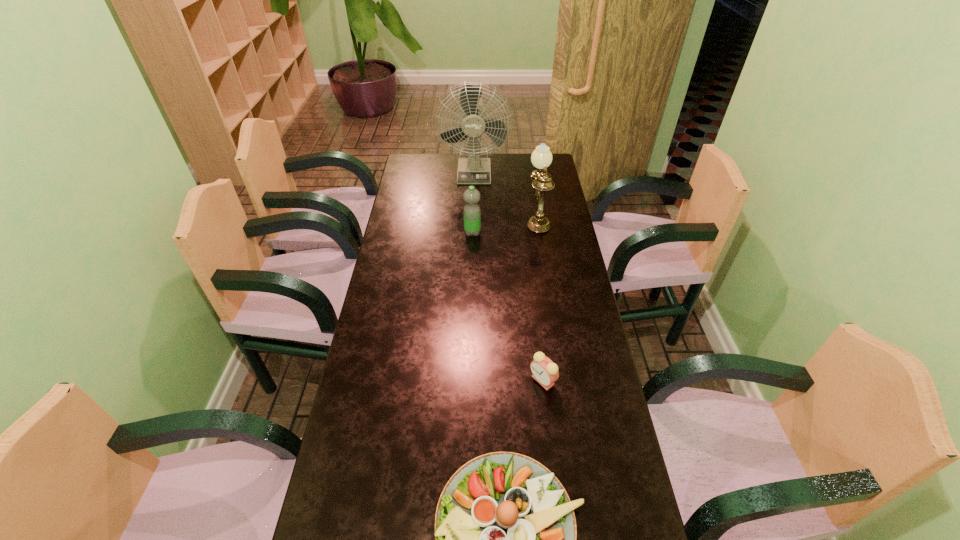
In order to click on fan in this screenshot , I will do `click(473, 170)`.

Identify the location of the farthest object. This screenshot has width=960, height=540. (473, 170).

Identify the location of the fourth shortest object. This screenshot has width=960, height=540. (541, 158).

The height and width of the screenshot is (540, 960). Find the location of `the third tallest object`. the third tallest object is located at coordinates (472, 214).

Identify the location of the second nearest object. This screenshot has height=540, width=960. (545, 372).

The image size is (960, 540). In order to click on vacant space located on the air flow direction of the farthest object in this screenshot , I will do coord(473,203).

At what (x,y) coordinates should I click in order to perform the action: click on free space located 0.300m on the left of the second tallest object. Please return your answer as a coordinate pair (x, y). The height and width of the screenshot is (540, 960). Looking at the image, I should click on (454, 218).

Image resolution: width=960 pixels, height=540 pixels. Find the location of `vacant space located 0.290m on the left of the water bottle`. vacant space located 0.290m on the left of the water bottle is located at coordinates (392, 232).

Find the location of `free location located 0.140m on the face of the alarm clock`. free location located 0.140m on the face of the alarm clock is located at coordinates (481, 380).

Where is `free space located 0.380m on the face of the alarm clock`? The height and width of the screenshot is (540, 960). free space located 0.380m on the face of the alarm clock is located at coordinates (397, 380).